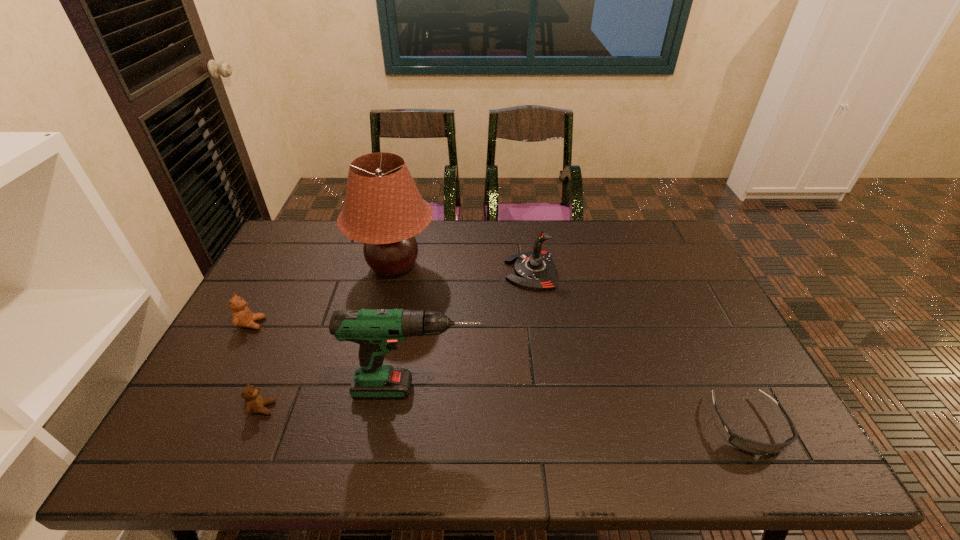
Locate an element on the screen. This screenshot has width=960, height=540. lampshade is located at coordinates (383, 209).

Find the location of `drill`. drill is located at coordinates (378, 331).

Image resolution: width=960 pixels, height=540 pixels. I want to click on joystick, so click(x=535, y=270).

This screenshot has height=540, width=960. What are the coordinates of `the fourth shortest object` in the screenshot? It's located at (535, 270).

Where is `the left teddy bear`? the left teddy bear is located at coordinates (242, 316).

Where is `the farther teddy bear`? This screenshot has width=960, height=540. the farther teddy bear is located at coordinates (242, 316).

At what (x,y) coordinates should I click in order to perform the action: click on the nearer teddy bear. Please return your answer as a coordinate pair (x, y). The height and width of the screenshot is (540, 960). Looking at the image, I should click on (254, 402).

Identify the location of the fifth tallest object. This screenshot has width=960, height=540. (254, 402).

Where is `the shortest object`? The width and height of the screenshot is (960, 540). the shortest object is located at coordinates (749, 446).

Image resolution: width=960 pixels, height=540 pixels. What are the coordinates of `goggles` in the screenshot? It's located at (749, 446).